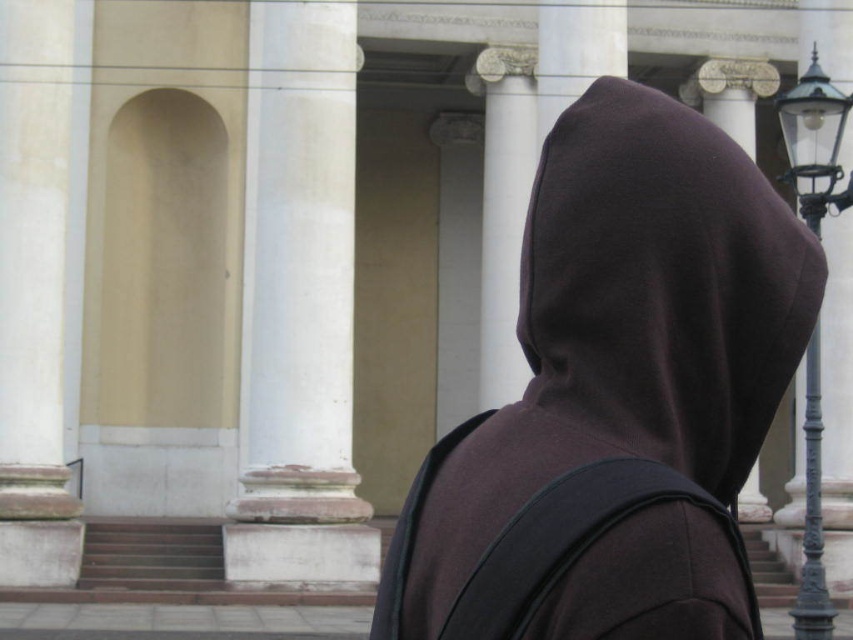
Between brown fleece hood at center and white marble column at center, which one has more height?

white marble column at center

Between point (693, 412) and point (341, 506), which one is positioned in front?

Point (693, 412)

Find the location of a particular element. brown fleece hood at center is located at coordinates (659, 289).

Is point (302, 100) positioned after point (811, 556)?

Yes, point (302, 100) is behind point (811, 556).

Does point (277, 140) lie in front of point (802, 208)?

No, (277, 140) is further to viewer.

Between point (341, 243) and point (805, 545), which one is positioned in front?

Point (805, 545)

Image resolution: width=853 pixels, height=640 pixels. Find the location of `white marble column at center`. white marble column at center is located at coordinates (299, 308).

You are a GUI agent. You are given a task and a screenshot of the screen. Output one action in this format:
    pyautogui.click(x=<x>, y=<y>)
    Task: Click on the brown fleece hood at center
    The image size is (853, 640).
    Given the screenshot: What is the action you would take?
    pyautogui.click(x=659, y=289)

Is brown fleece hood at center to the right of polished brass lamp post at right from the viewer's perspective?

In fact, brown fleece hood at center is to the left of polished brass lamp post at right.

Which is in front, point (657, 150) or point (815, 547)?

Point (657, 150) is more forward.

At what (x,y) coordinates should I click in order to perform the action: click on brown fleece hood at center. Please return your answer as a coordinate pair (x, y). This screenshot has width=853, height=640. Looking at the image, I should click on (659, 289).